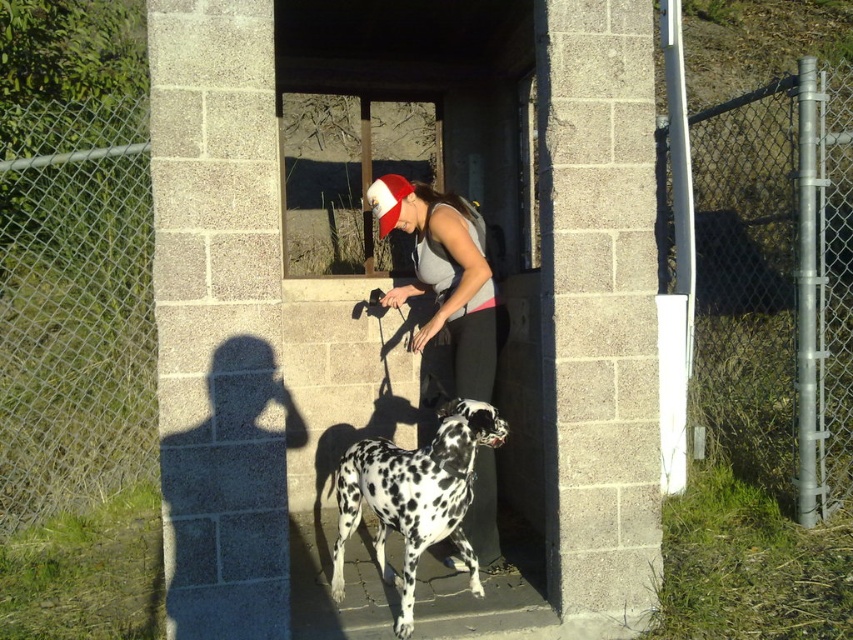
You are standing at the point with coordinates point (x=390, y=204) and want to move to the point with coordinates point (x=387, y=474). Which direction should you move to reach your destination?

You should move forward because point (x=387, y=474) is in front of point (x=390, y=204).